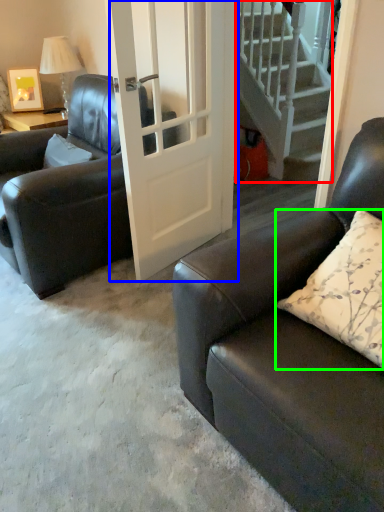
Question: Estimate the real-world distances between objects in this image. Which object is farther from stairs (highlighted by a red box), door (highlighted by a blue box) or pillow (highlighted by a green box)?

Choices:
 (A) door
 (B) pillow

Answer: (B)